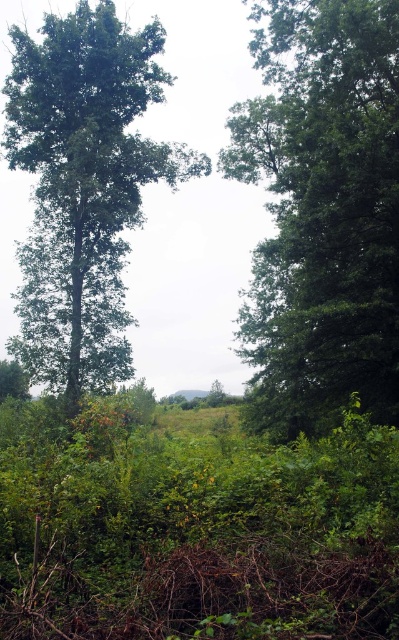
Between green leafy tree at center and green leafy tree at left, which one appears on the right side from the viewer's perspective?

green leafy tree at center

Does green leafy tree at center have a smaller size compared to green leafy tree at left?

No, green leafy tree at center is not smaller than green leafy tree at left.

Identify the location of green leafy tree at center. This screenshot has width=399, height=640. (321, 212).

This screenshot has width=399, height=640. I want to click on green leafy tree at center, so click(321, 212).